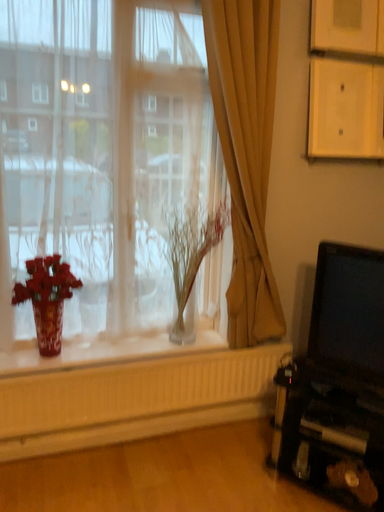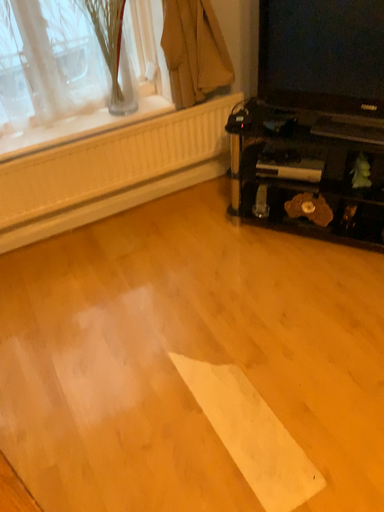
Question: How did the camera likely rotate when shooting the video?

Choices:
 (A) rotated left
 (B) rotated right

Answer: (B)